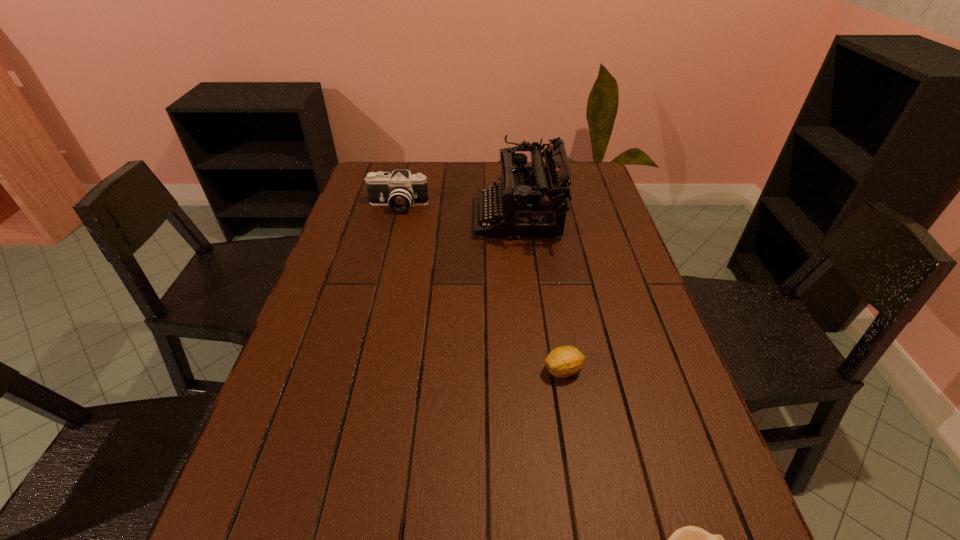
I want to click on unoccupied area between the taller lemon and the second tallest object, so click(x=481, y=288).

The image size is (960, 540). Identify the location of vacant space that's between the tallest object and the second nearest object. (541, 294).

This screenshot has width=960, height=540. I want to click on the closest object to the tallest object, so click(x=401, y=190).

Identify which object is the second nearest to the tallest object. Please provide its 2D coordinates. Your answer should be formatted as a tuple, i.e. [(x, y)], where the tuple contains the x and y coordinates of a point satisfying the conditions above.

[(565, 361)]